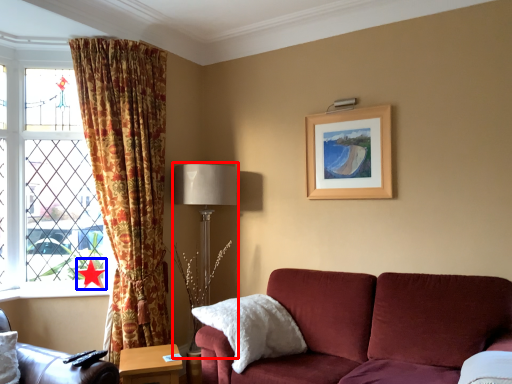
Question: Which object is further to the camera taking this photo, table lamp (highlighted by a red box) or star (highlighted by a blue box)?

Choices:
 (A) table lamp
 (B) star

Answer: (B)